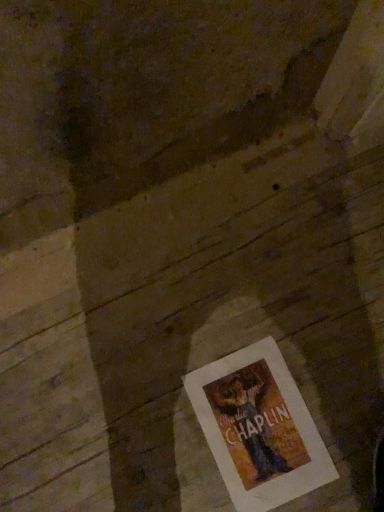
Where is `matte paper poster at lower center`? The image size is (384, 512). matte paper poster at lower center is located at coordinates (259, 428).

The image size is (384, 512). Describe the element at coordinates (259, 428) in the screenshot. I see `matte paper poster at lower center` at that location.

The image size is (384, 512). Identify the location of matte paper poster at lower center. (259, 428).